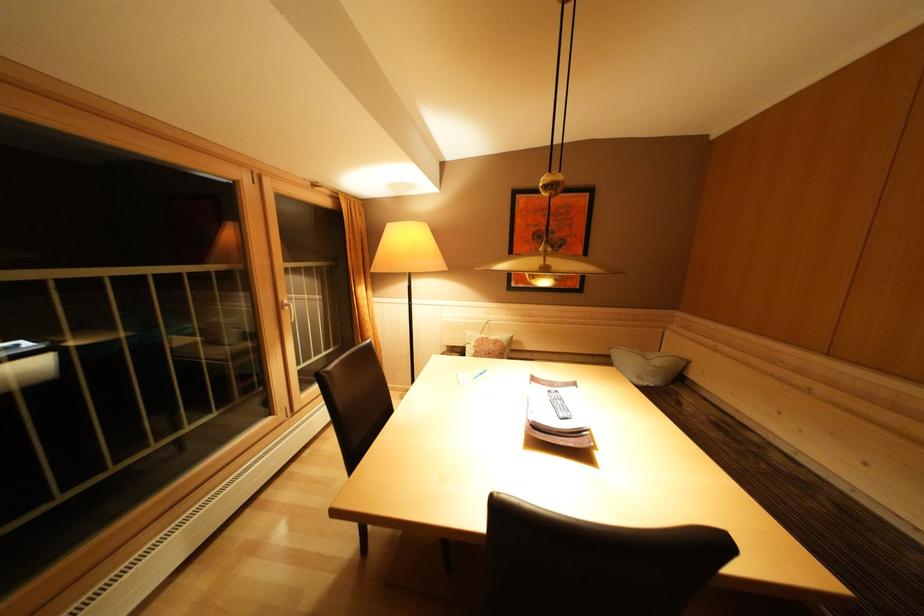
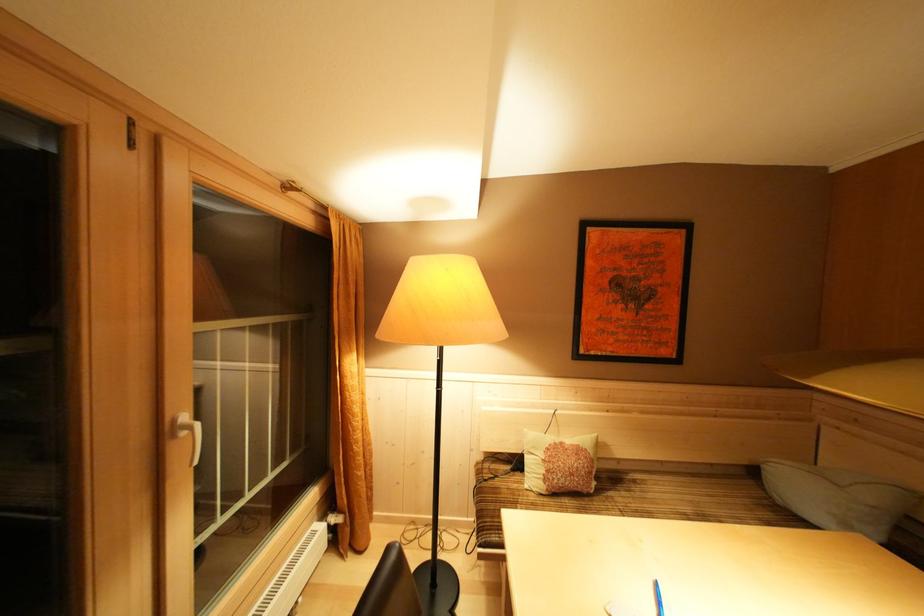
The point at (x=664, y=368) is marked in the first image. Where is the corresponding point in the second image?

(879, 503)